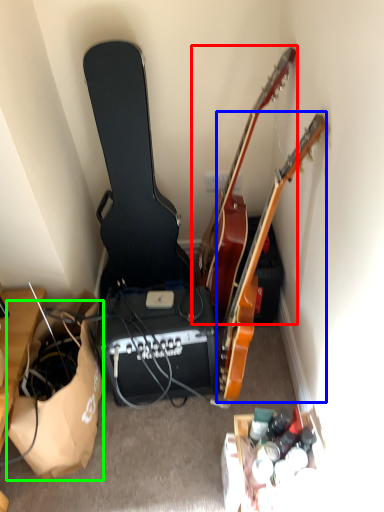
Question: Which is farther away from guitar (highlighted by a red box)? guitar (highlighted by a blue box) or paper bag (highlighted by a green box)?

Choices:
 (A) guitar
 (B) paper bag

Answer: (B)